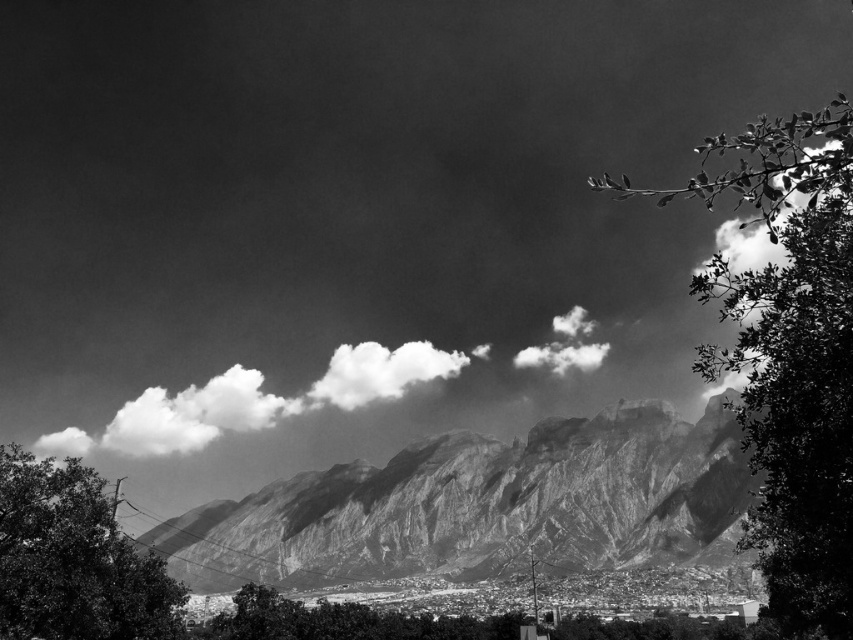
You are an airplane pilot flying through the cloudy sky at center and the white fluffy cloud at center. Which one is higher in the sky?

The cloudy sky at center is much taller than the white fluffy cloud at center, so the cloudy sky at center is higher in the sky.

You are an observer looking at this black and white photo. You notice a green leafy tree at lower left and a white fluffy cloud at center. Which object is closer to the left edge of the photo?

The green leafy tree at lower left is closer to the left edge of the photo because it is positioned on the left side of the white fluffy cloud at center.